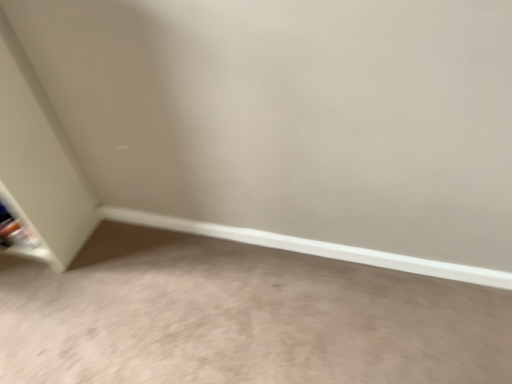
Question: From a real-world perspective, is metallic silver shelf at lower left physically located above or below gray carpet at lower left?

Choices:
 (A) above
 (B) below

Answer: (A)

Question: Is point (4, 223) closer or farther from the camera than point (238, 254)?

Choices:
 (A) farther
 (B) closer

Answer: (A)

Question: Considering the relative positions of metallic silver shelf at lower left and gray carpet at lower left in the image provided, is metallic silver shelf at lower left to the left or to the right of gray carpet at lower left?

Choices:
 (A) left
 (B) right

Answer: (A)

Question: Is point (2, 288) closer or farther from the camera than point (5, 190)?

Choices:
 (A) farther
 (B) closer

Answer: (A)

Question: Would you say gray carpet at lower left is to the left or to the right of metallic silver shelf at lower left in the picture?

Choices:
 (A) left
 (B) right

Answer: (B)

Question: Considering the positions of gray carpet at lower left and metallic silver shelf at lower left in the image, is gray carpet at lower left taller or shorter than metallic silver shelf at lower left?

Choices:
 (A) short
 (B) tall

Answer: (A)

Question: From a real-world perspective, is gray carpet at lower left above or below metallic silver shelf at lower left?

Choices:
 (A) below
 (B) above

Answer: (A)